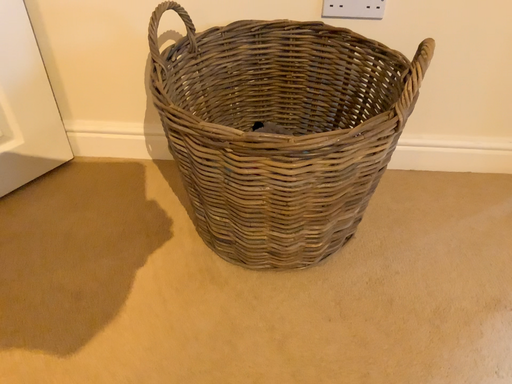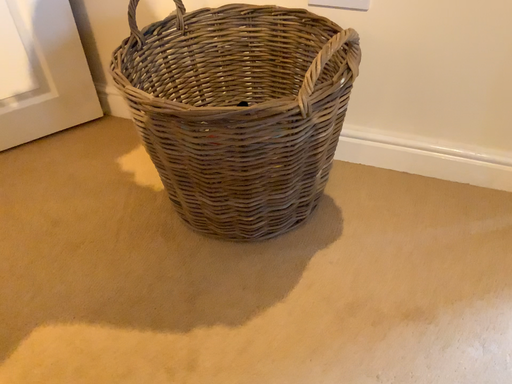
Question: Which way did the camera rotate in the video?

Choices:
 (A) rotated left
 (B) rotated right

Answer: (A)